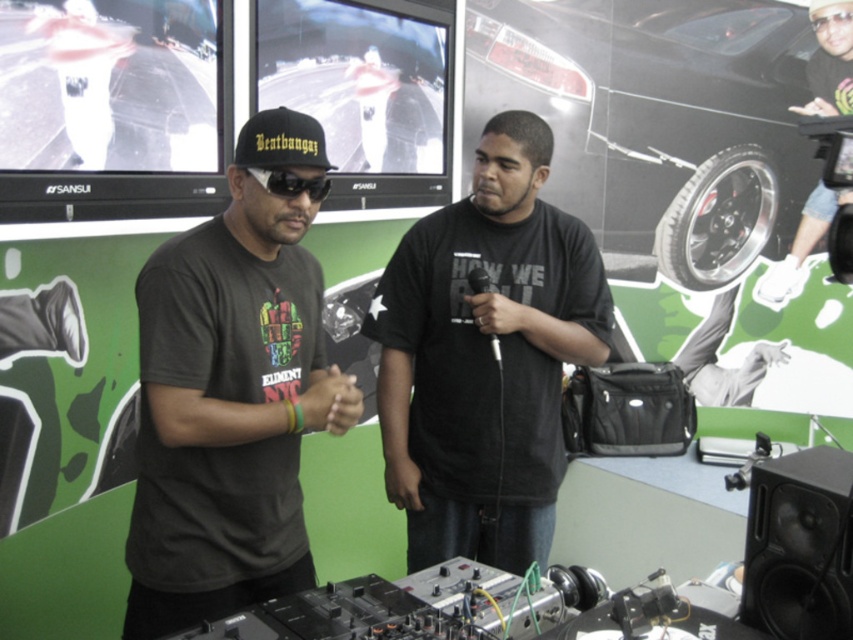
Is point (796, 241) in front of point (323, 147)?

No, (796, 241) is behind (323, 147).

Does point (843, 97) come farther from viewer compared to point (236, 138)?

Yes, point (843, 97) is behind point (236, 138).

Is point (811, 232) in front of point (282, 113)?

No, it is behind (282, 113).

Where is `black matte camera at upper right`? This screenshot has height=640, width=853. black matte camera at upper right is located at coordinates (801, 244).

Based on the photo, is black matte speaker at lower right to the right of black matte baseball cap at upper center from the viewer's perspective?

Correct, you'll find black matte speaker at lower right to the right of black matte baseball cap at upper center.

What do you see at coordinates (799, 547) in the screenshot?
I see `black matte speaker at lower right` at bounding box center [799, 547].

Image resolution: width=853 pixels, height=640 pixels. In order to click on black matte speaker at lower right in this screenshot , I will do `click(799, 547)`.

Can you confirm if black matte baseball cap at upper center is bigger than transparent plastic goggles at upper right?

Yes.

Can you confirm if black matte baseball cap at upper center is shorter than transparent plastic goggles at upper right?

No, black matte baseball cap at upper center is not shorter than transparent plastic goggles at upper right.

Which is behind, point (273, 136) or point (827, 26)?

Positioned behind is point (827, 26).

Locate an element on the screen. The width and height of the screenshot is (853, 640). black matte baseball cap at upper center is located at coordinates (281, 140).